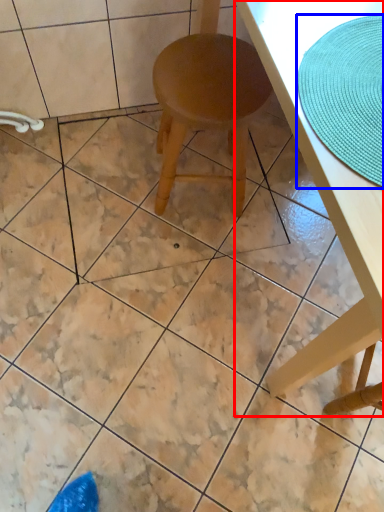
Question: Which of the following is the closest to the observer, table (highlighted by a red box) or mat (highlighted by a blue box)?

Choices:
 (A) table
 (B) mat

Answer: (A)